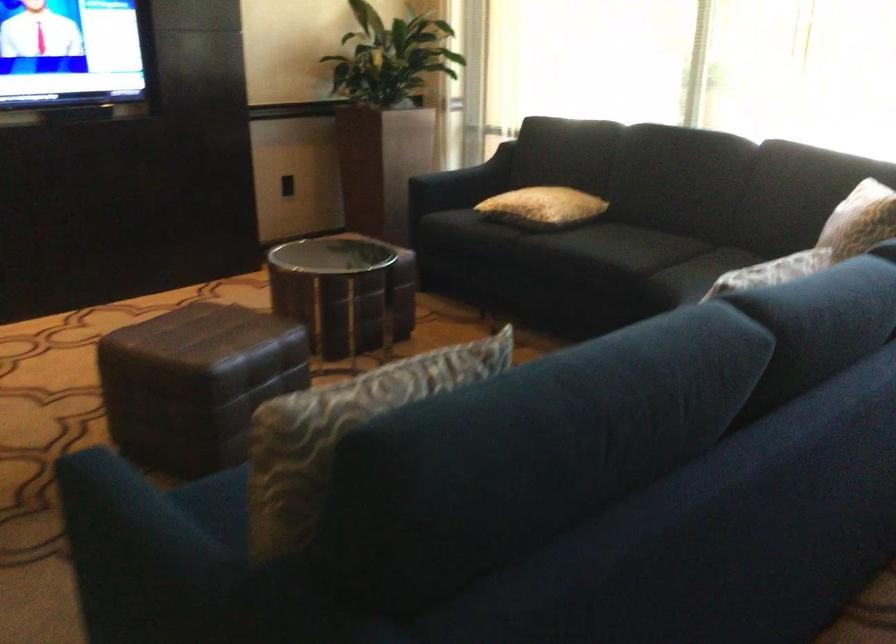
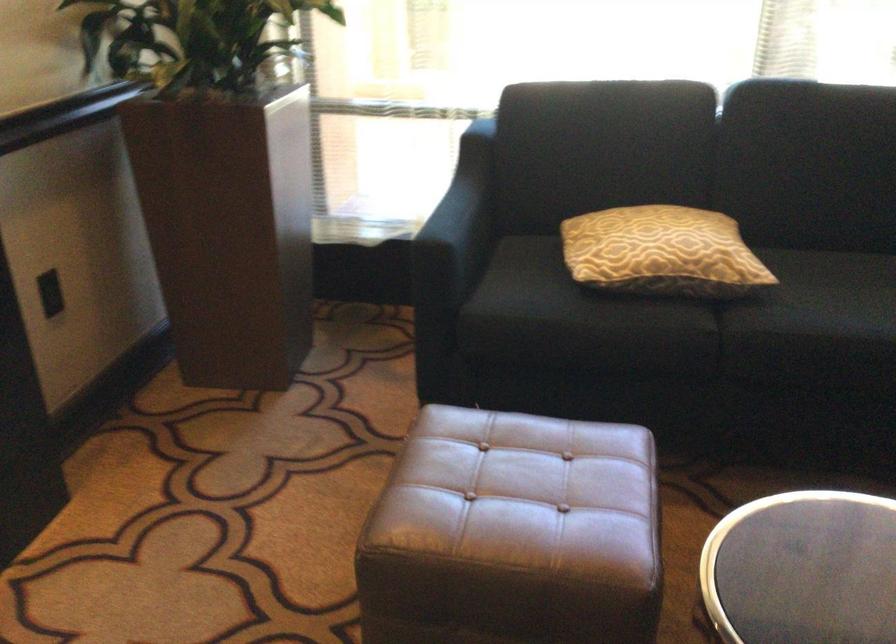
Find the pixel in the second image that matches (553,225) in the first image.

(752, 289)